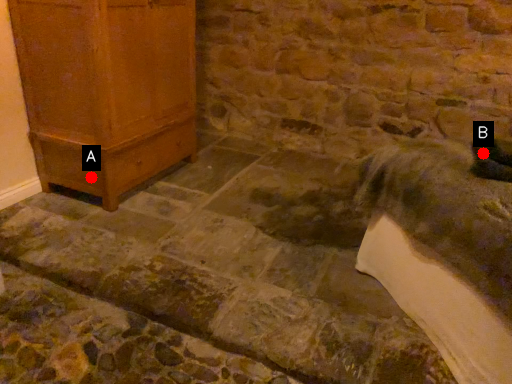
Question: Two points are circled on the image, labeled by A and B beside each circle. Among these points, which one is farthest from the camera?

Choices:
 (A) A is further
 (B) B is further

Answer: (A)